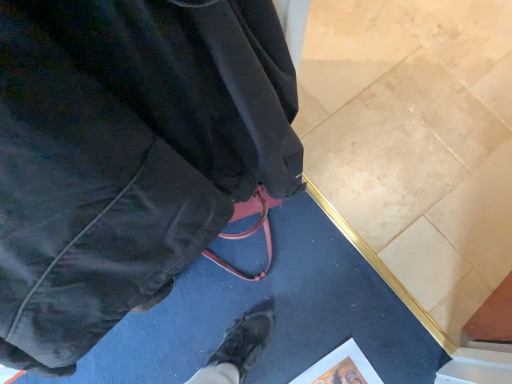
Question: Does orange matte paper at lower center have a smaller size compared to matte black jacket at center?

Choices:
 (A) no
 (B) yes

Answer: (B)

Question: From a real-world perspective, is orange matte paper at lower center beneath matte black jacket at center?

Choices:
 (A) yes
 (B) no

Answer: (A)

Question: Is orange matte paper at lower center thinner than matte black jacket at center?

Choices:
 (A) no
 (B) yes

Answer: (A)

Question: Does orange matte paper at lower center touch matte black jacket at center?

Choices:
 (A) no
 (B) yes

Answer: (A)

Question: Considering the relative positions of orange matte paper at lower center and matte black jacket at center in the image provided, is orange matte paper at lower center to the right of matte black jacket at center from the viewer's perspective?

Choices:
 (A) no
 (B) yes

Answer: (B)

Question: From the image's perspective, is orange matte paper at lower center over matte black jacket at center?

Choices:
 (A) yes
 (B) no

Answer: (B)

Question: Is matte black jacket at center located outside orange matte paper at lower center?

Choices:
 (A) no
 (B) yes

Answer: (B)

Question: Considering the relative sizes of matte black jacket at center and orange matte paper at lower center in the image provided, is matte black jacket at center bigger than orange matte paper at lower center?

Choices:
 (A) no
 (B) yes

Answer: (B)

Question: Considering the relative sizes of matte black jacket at center and orange matte paper at lower center in the image provided, is matte black jacket at center shorter than orange matte paper at lower center?

Choices:
 (A) yes
 (B) no

Answer: (B)

Question: Considering the relative sizes of matte black jacket at center and orange matte paper at lower center in the image provided, is matte black jacket at center taller than orange matte paper at lower center?

Choices:
 (A) no
 (B) yes

Answer: (B)

Question: Can you confirm if matte black jacket at center is smaller than orange matte paper at lower center?

Choices:
 (A) yes
 (B) no

Answer: (B)

Question: Is matte black jacket at center wider than orange matte paper at lower center?

Choices:
 (A) no
 (B) yes

Answer: (A)

Question: Does point (96, 231) appear closer or farther from the camera than point (301, 377)?

Choices:
 (A) closer
 (B) farther

Answer: (A)